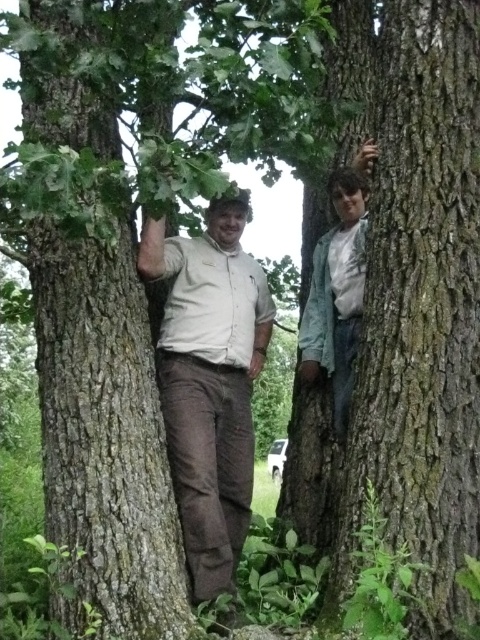
You are a photographer trying to capture both the matte khaki shirt at center and the green cotton shirt at right in a single frame. Based on their positions, which shirt should you focus on first to ensure both are in the frame?

The matte khaki shirt at center is below the green cotton shirt at right, so you should focus on the green cotton shirt at right first to ensure both are in the frame.

Consider the image. You are a photographer standing 2 meters away from the smooth brown bark at left. Can you reach out and touch the bark without moving your feet?

The smooth brown bark at left is 1.98 meters away from the camera, so yes, you can reach out and touch it without moving your feet since you are standing 2 meters away.